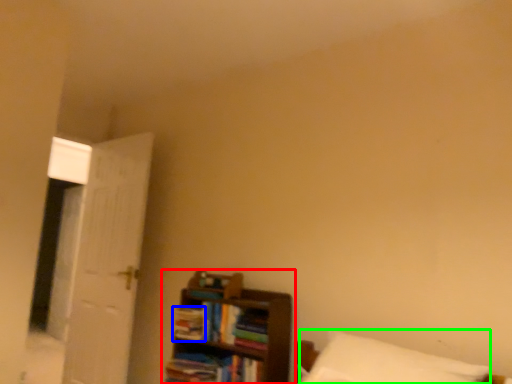
Question: Considering the real-world distances, which object is farthest from shelf (highlighted by a red box)? book (highlighted by a blue box) or pillow (highlighted by a green box)?

Choices:
 (A) book
 (B) pillow

Answer: (B)